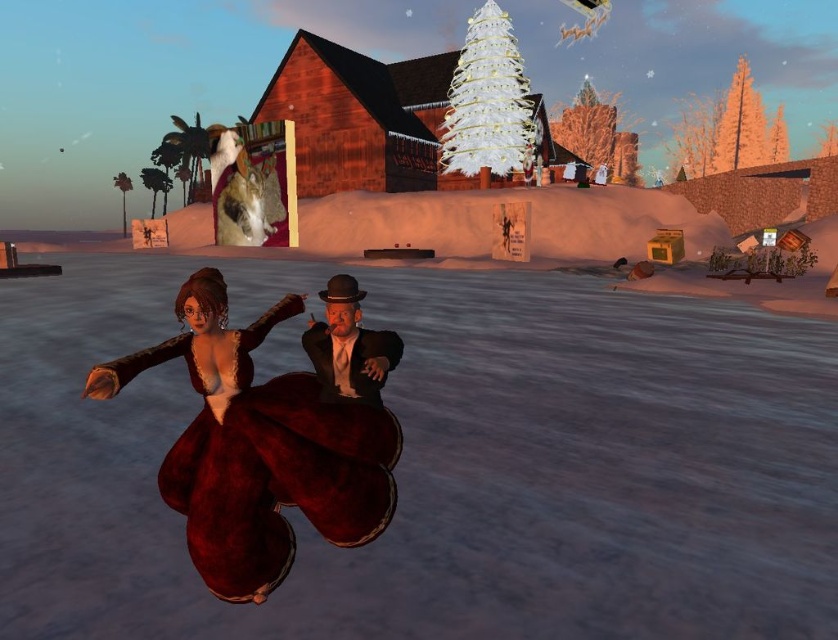
In the snowy evening scene, there are two characters dressed in period clothing. The first is a character wearing a velvet maroon dress at center and the second is a character in a formal black suit with a bowler hat. If you were to draw a line from the top of the velvet maroon dress at center to the bottom of the formal black suit with a bowler hat, would the line pass through the point marked at coordinates (260, 449)?

The point marked at coordinates (260, 449) indicates the location of the velvet maroon dress at center. Since the line would start at the top of the dress and extend downward towards the bottom of the formal black suit with a bowler hat, the line would indeed pass through the point marked at (260, 449) as it is the location of the dress itself.

You are navigating a virtual environment and need to locate the velvet maroon dress at center. According to the scene description, where exactly is the velvet maroon dress positioned in terms of coordinates?

The velvet maroon dress at center is located at point coordinates (260,449).